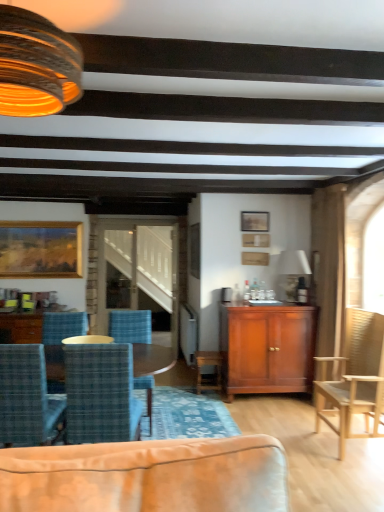
This screenshot has width=384, height=512. I want to click on matte wood cabinet at center, so click(267, 348).

What do you see at coordinates (267, 348) in the screenshot? I see `matte wood cabinet at center` at bounding box center [267, 348].

The image size is (384, 512). Identify the location of wooden chair at right. pos(328,267).

Image resolution: width=384 pixels, height=512 pixels. In order to click on matte wood cabinet at center in this screenshot , I will do `click(267, 348)`.

From the image's perspective, between wooden picture frame at upper center, which ranks as the 3th picture frame in left-to-right order, and wooden glossy coffee table at lower left, which one is located above?

wooden picture frame at upper center, which ranks as the 3th picture frame in left-to-right order, is shown above in the image.

Which picture frame is the 3rd one when counting from the right side of the wooden glossy coffee table at lower left? Please provide its 2D coordinates.

[(256, 240)]

Is wooden picture frame at upper center, which ranks as the 3th picture frame in left-to-right order, oriented away from wooden glossy coffee table at lower left?

That's not correct — wooden picture frame at upper center, which ranks as the 3th picture frame in left-to-right order, is not looking away from wooden glossy coffee table at lower left.

Which is closer, [336,277] or [241,216]?

Point [336,277] is closer to the camera than point [241,216].

Which object is positioned more to the right, wooden chair at right or wooden picture frame at upper center, the second picture frame positioned from the left?

From the viewer's perspective, wooden chair at right appears more on the right side.

Who is smaller, wooden chair at right or wooden picture frame at upper center, acting as the second picture frame starting from the back?

wooden picture frame at upper center, acting as the second picture frame starting from the back, is smaller.

Based on their sizes in the image, would you say wooden picture frame at upper center, marked as the second picture frame in a front-to-back arrangement, is bigger or smaller than plaid fabric chair at lower left, which is the 1th chair in left-to-right order?

Considering their sizes, wooden picture frame at upper center, marked as the second picture frame in a front-to-back arrangement, takes up less space than plaid fabric chair at lower left, which is the 1th chair in left-to-right order.

Is point (250, 221) in front of point (56, 418)?

No.

From their relative heights in the image, would you say wooden picture frame at upper center, the second picture frame positioned from the left, is taller or shorter than plaid fabric chair at lower left, which is the 1th chair in left-to-right order?

In the image, wooden picture frame at upper center, the second picture frame positioned from the left, appears to be shorter than plaid fabric chair at lower left, which is the 1th chair in left-to-right order.

Locate an element on the screen. The width and height of the screenshot is (384, 512). the 2nd picture frame behind the plaid fabric chair at lower left, the fourth chair viewed from the right, starting your count from the anchor is located at coordinates (255, 221).

From the image's perspective, which is below, wooden chair at right or plaid fabric chair at lower left, which is the 1th chair in left-to-right order?

plaid fabric chair at lower left, which is the 1th chair in left-to-right order, from the image's perspective.

Where is `curtain located above the plaid fabric chair at lower left, which is the 1th chair in left-to-right order (from the image's perspective)`? The height and width of the screenshot is (512, 384). curtain located above the plaid fabric chair at lower left, which is the 1th chair in left-to-right order (from the image's perspective) is located at coordinates (328, 267).

Consider the image. Is wooden chair at right inside the boundaries of plaid fabric chair at lower left, which is the 1th chair in left-to-right order, or outside?

wooden chair at right is not inside plaid fabric chair at lower left, which is the 1th chair in left-to-right order, it's outside.

Who is more distant, wooden chair at right or plaid fabric chair at lower left, which is the 1th chair in left-to-right order?

Positioned behind is wooden chair at right.

From a real-world perspective, which object stands above the other?

matte glass lampshade at upper left, the second lamp ordered from the bottom, is physically above.

Does point (249, 311) come in front of point (76, 61)?

No, (249, 311) is behind (76, 61).

From the image's perspective, is matte wood cabinet at center located above or below matte glass lampshade at upper left, which is counted as the 1th lamp, starting from the left?

From the image's perspective, matte wood cabinet at center appears below matte glass lampshade at upper left, which is counted as the 1th lamp, starting from the left.

Does matte wood cabinet at center lie behind matte glass lampshade at upper left, which is counted as the 1th lamp, starting from the left?

Yes.

From the image's perspective, which is above, plaid fabric chair at lower left, the fourth chair viewed from the right, or blue plaid fabric chair at center, positioned as the third chair in left-to-right order?

From the image's view, blue plaid fabric chair at center, positioned as the third chair in left-to-right order, is above.

How different are the orientations of plaid fabric chair at lower left, which is the 1th chair in left-to-right order, and blue plaid fabric chair at center, which ranks as the 2th chair in right-to-left order, in degrees?

The facing directions of plaid fabric chair at lower left, which is the 1th chair in left-to-right order, and blue plaid fabric chair at center, which ranks as the 2th chair in right-to-left order, are 0.13 degrees apart.

Is plaid fabric chair at lower left, the fourth chair viewed from the right, positioned with its back to blue plaid fabric chair at center, which ranks as the 2th chair in right-to-left order?

plaid fabric chair at lower left, the fourth chair viewed from the right, does not have its back to blue plaid fabric chair at center, which ranks as the 2th chair in right-to-left order.

Is plaid fabric chair at lower left, which is the 1th chair in left-to-right order, next to blue plaid fabric chair at center, which ranks as the 2th chair in right-to-left order, and touching it?

No.

Between matte glass lampshade at upper left, which is counted as the 1th lamp, starting from the left, and wooden glossy coffee table at lower left, which one appears on the right side from the viewer's perspective?

matte glass lampshade at upper left, which is counted as the 1th lamp, starting from the left, is more to the right.

Is point (45, 73) closer or farther from the camera than point (33, 312)?

Point (45, 73) is positioned closer to the camera compared to point (33, 312).

Who is taller, matte glass lampshade at upper left, arranged as the 2th lamp when viewed from the right, or wooden glossy coffee table at lower left?

With more height is wooden glossy coffee table at lower left.

Which of these two, matte glass lampshade at upper left, which is counted as the 1th lamp, starting from the left, or wooden glossy coffee table at lower left, is thinner?

matte glass lampshade at upper left, which is counted as the 1th lamp, starting from the left, is thinner.

Identify the location of coffee table below the wooden picture frame at upper center, which is counted as the 1th picture frame, starting from the right (from the image's perspective). pos(21,327).

The image size is (384, 512). In order to click on the 3rd picture frame above the wooden chair at right (from the image's perspective) in this screenshot , I will do `click(255, 221)`.

Looking at the image, which one is located further to clear glass window screen at center, plaid fabric chair at lower left, the fourth chair viewed from the right, or light brown wood chair at right, arranged as the first chair when viewed from the right?

plaid fabric chair at lower left, the fourth chair viewed from the right.

When comparing their distances from clear glass window screen at center, does matte glass lampshade at upper left, arranged as the 2th lamp when viewed from the right, or blue plaid fabric chair at center, which ranks as the 2th chair in right-to-left order, seem further?

The object further to clear glass window screen at center is matte glass lampshade at upper left, arranged as the 2th lamp when viewed from the right.

Considering their positions, is matte white lampshade at upper center, the second lamp when ordered from top to bottom, positioned further to blue plaid chair at center, which is counted as the 3th chair, starting from the right, than matte glass lampshade at upper left, which appears as the 1th lamp when viewed from the top?

Based on the image, matte glass lampshade at upper left, which appears as the 1th lamp when viewed from the top, appears to be further to blue plaid chair at center, which is counted as the 3th chair, starting from the right.

From the picture: Considering their positions, is blue plaid fabric chair at center, positioned as the third chair in left-to-right order, positioned further to blue plaid chair at center, which is counted as the 3th chair, starting from the right, than matte wood cabinet at center?

matte wood cabinet at center is positioned further to the anchor blue plaid chair at center, which is counted as the 3th chair, starting from the right.

From the image, which object appears to be nearer to wooden chair at right, wooden framed painting at upper left, the third picture frame positioned from the right, or plaid fabric chair at lower left, which is the 1th chair in left-to-right order?

Among the two, plaid fabric chair at lower left, which is the 1th chair in left-to-right order, is located nearer to wooden chair at right.

When comparing their distances from plaid fabric chair at lower left, the fourth chair viewed from the right, does matte white lampshade at upper center, the second lamp viewed from the front, or light brown wood chair at right, positioned as the fourth chair in left-to-right order, seem further?

matte white lampshade at upper center, the second lamp viewed from the front, lies further to plaid fabric chair at lower left, the fourth chair viewed from the right, than the other object.

From the image, which object appears to be farther from wooden framed painting at upper left, the third picture frame in the front-to-back sequence, matte wood cabinet at center or wooden chair at right?

wooden chair at right lies further to wooden framed painting at upper left, the third picture frame in the front-to-back sequence, than the other object.

Looking at the image, which one is located closer to matte white lampshade at upper center, the second lamp when ordered from top to bottom, wooden framed painting at upper left, which appears as the 1th picture frame when viewed from the left, or plaid fabric chair at lower left, which is the 1th chair in left-to-right order?

Based on the image, plaid fabric chair at lower left, which is the 1th chair in left-to-right order, appears to be nearer to matte white lampshade at upper center, the second lamp when ordered from top to bottom.

Locate an element on the screen. window screen located between wooden glossy coffee table at lower left and light brown wood chair at right, arranged as the first chair when viewed from the right, in the left-right direction is located at coordinates (140, 265).

The width and height of the screenshot is (384, 512). Identify the location of chair positioned between light brown wood chair at right, arranged as the first chair when viewed from the right, and wooden picture frame at upper center, acting as the second picture frame starting from the back, from near to far. (130, 326).

Identify the location of window screen between wooden framed painting at upper left, which appears as the 1th picture frame when viewed from the left, and wooden picture frame at upper center, arranged as the second picture frame when viewed from the right. (140, 265).

This screenshot has width=384, height=512. What are the coordinates of `picture frame between blue plaid fabric chair at center, positioned as the third chair in left-to-right order, and wooden picture frame at upper center, arranged as the second picture frame when viewed from the right, in the front-back direction` in the screenshot? It's located at (256, 240).